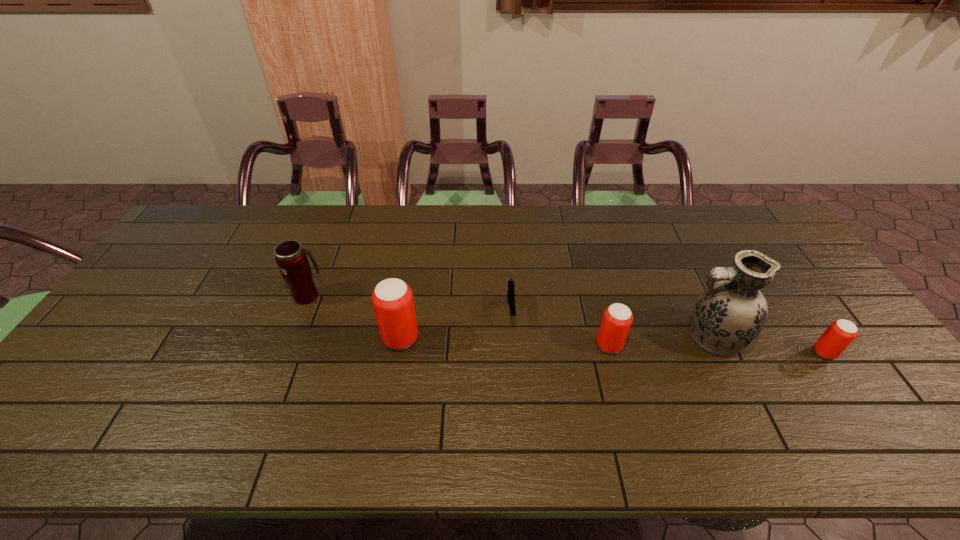
I want to click on vacant area that satisfies the following two spatial constraints: 1. on the front side of the fifth tallest object; 2. on the left side of the second beer can from right to left, so [x=612, y=353].

At what (x,y) coordinates should I click in order to perform the action: click on free space that satisfies the following two spatial constraints: 1. on the back side of the second object from left to right; 2. with the handle on the side of the tallest object. Please return your answer as a coordinate pair (x, y). The width and height of the screenshot is (960, 540). Looking at the image, I should click on (400, 338).

This screenshot has height=540, width=960. I want to click on blank space that satisfies the following two spatial constraints: 1. on the front-facing side of the pistol; 2. with the handle on the side of the tallest object, so click(x=513, y=338).